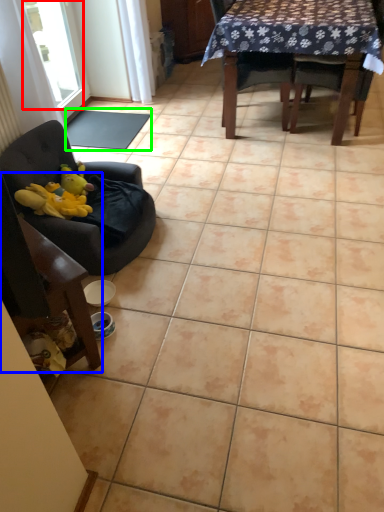
Question: Estimate the real-world distances between objects in this image. Which object is closer to window (highlighted by a red box), chair (highlighted by a blue box) or mat (highlighted by a green box)?

Choices:
 (A) chair
 (B) mat

Answer: (B)